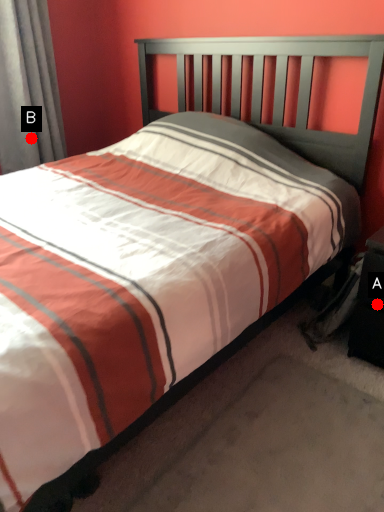
Question: Two points are circled on the image, labeled by A and B beside each circle. Which point appears farthest from the camera in this image?

Choices:
 (A) A is further
 (B) B is further

Answer: (B)